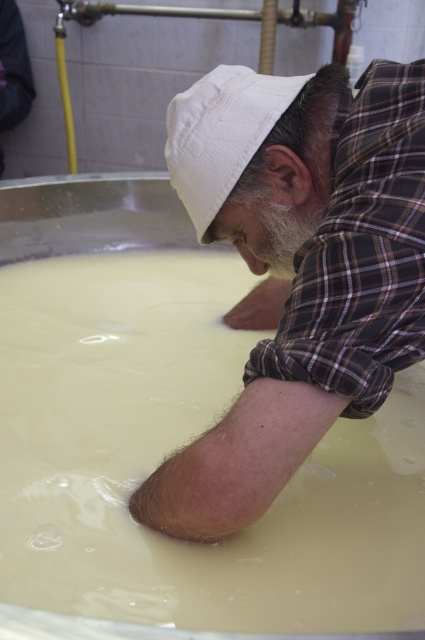
Is white creamy milk at center above matte white hat at center?

No, white creamy milk at center is not above matte white hat at center.

Can you confirm if white creamy milk at center is positioned to the right of matte white hat at center?

Incorrect, white creamy milk at center is not on the right side of matte white hat at center.

Does point (365, 608) come in front of point (181, 93)?

That is True.

I want to click on white creamy milk at center, so click(x=176, y=449).